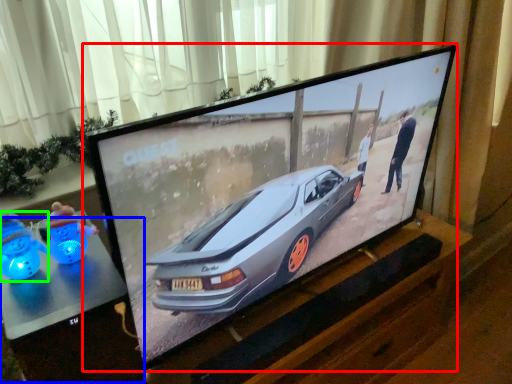
Question: Considering the real-world distances, which object is farthest from television (highlighted by a red box)? table (highlighted by a blue box) or toy (highlighted by a green box)?

Choices:
 (A) table
 (B) toy

Answer: (B)